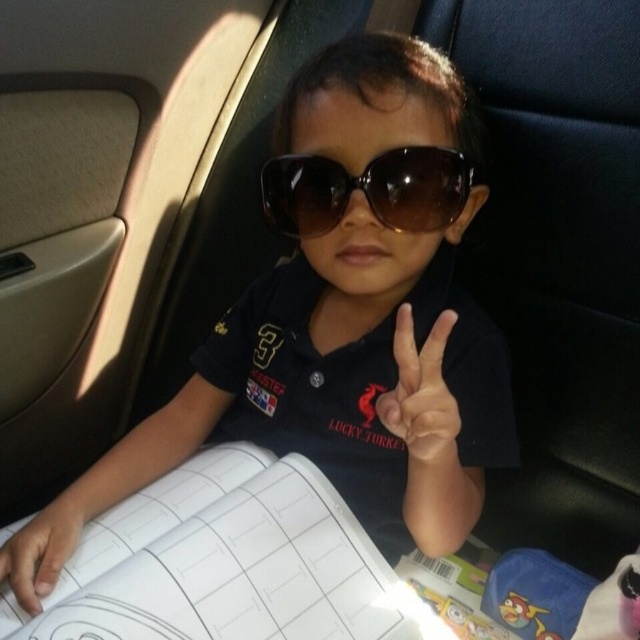
Question: Which object is the closest to the smooth skin hand at lower left?

Choices:
 (A) matte black hand at center
 (B) brown matte sunglasses at center

Answer: (A)

Question: Can you confirm if brown matte sunglasses at center is positioned to the right of matte black hand at center?

Choices:
 (A) yes
 (B) no

Answer: (B)

Question: Which point is closer to the camera?

Choices:
 (A) smooth skin hand at lower left
 (B) matte black hand at center
 (C) brown matte sunglasses at center

Answer: (B)

Question: From the image, what is the correct spatial relationship of matte black hand at center in relation to smooth skin hand at lower left?

Choices:
 (A) below
 (B) above

Answer: (B)

Question: Does brown matte sunglasses at center appear over smooth skin hand at lower left?

Choices:
 (A) yes
 (B) no

Answer: (A)

Question: Which point is closer to the camera?

Choices:
 (A) smooth skin hand at lower left
 (B) brown matte sunglasses at center

Answer: (A)